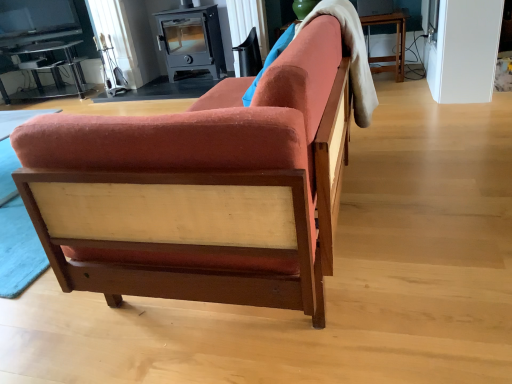
This screenshot has height=384, width=512. I want to click on clear glass table at upper left, so click(50, 72).

Is metallic wood-burning stove at upper center at the back of matte black swivel chair at upper center?

No, matte black swivel chair at upper center is not facing the opposite direction of metallic wood-burning stove at upper center.

Based on their sizes in the image, would you say matte black swivel chair at upper center is bigger or smaller than metallic wood-burning stove at upper center?

Considering their sizes, matte black swivel chair at upper center takes up less space than metallic wood-burning stove at upper center.

Considering the positions of objects matte black swivel chair at upper center and metallic wood-burning stove at upper center in the image provided, who is more to the right, matte black swivel chair at upper center or metallic wood-burning stove at upper center?

Positioned to the right is matte black swivel chair at upper center.

Considering the relative positions of matte black swivel chair at upper center and metallic wood-burning stove at upper center in the image provided, is matte black swivel chair at upper center in front of metallic wood-burning stove at upper center?

Yes, it is in front of metallic wood-burning stove at upper center.

Considering the relative positions of clear glass table at upper left and velvet orange couch at center in the image provided, is clear glass table at upper left to the left of velvet orange couch at center from the viewer's perspective?

Indeed, clear glass table at upper left is positioned on the left side of velvet orange couch at center.

Looking at this image, which of these two, clear glass table at upper left or velvet orange couch at center, is bigger?

velvet orange couch at center is bigger.

Looking at this image, from a real-world perspective, which object stands above the other?

In real-world perspective, velvet orange couch at center is above.

Consider the image. Between clear glass table at upper left and velvet orange couch at center, which one is positioned in front?

Positioned in front is velvet orange couch at center.

Does velvet orange couch at center have a greater width compared to metallic wood-burning stove at upper center?

Indeed, velvet orange couch at center has a greater width compared to metallic wood-burning stove at upper center.

From a real-world perspective, who is located higher, velvet orange couch at center or metallic wood-burning stove at upper center?

metallic wood-burning stove at upper center, from a real-world perspective.

Is velvet orange couch at center next to metallic wood-burning stove at upper center and touching it?

velvet orange couch at center and metallic wood-burning stove at upper center are not in contact.

Is velvet orange couch at center positioned in front of metallic wood-burning stove at upper center?

Yes, it is in front of metallic wood-burning stove at upper center.

Does velvet orange couch at center have a lesser height compared to matte black swivel chair at upper center?

In fact, velvet orange couch at center may be taller than matte black swivel chair at upper center.

Would you say velvet orange couch at center is a long distance from matte black swivel chair at upper center?

Yes, velvet orange couch at center and matte black swivel chair at upper center are quite far apart.

From the image's perspective, is velvet orange couch at center located above or below matte black swivel chair at upper center?

velvet orange couch at center is situated lower than matte black swivel chair at upper center in the image.

Is velvet orange couch at center behind matte black swivel chair at upper center?

No.

Is point (322, 296) more distant than point (73, 88)?

No, (322, 296) is closer to viewer.

Measure the distance from velvet orange couch at center to clear glass table at upper left.

A distance of 3.67 meters exists between velvet orange couch at center and clear glass table at upper left.

Do you think velvet orange couch at center is within clear glass table at upper left, or outside of it?

velvet orange couch at center is not inside clear glass table at upper left, it's outside.

Consider the image. In terms of height, does velvet orange couch at center look taller or shorter compared to clear glass table at upper left?

In the image, velvet orange couch at center appears to be taller than clear glass table at upper left.

Is metallic wood-burning stove at upper center beside matte black swivel chair at upper center?

No, metallic wood-burning stove at upper center is not with matte black swivel chair at upper center.

Considering the positions of objects metallic wood-burning stove at upper center and matte black swivel chair at upper center in the image provided, who is more to the right, metallic wood-burning stove at upper center or matte black swivel chair at upper center?

From the viewer's perspective, matte black swivel chair at upper center appears more on the right side.

Which object is closer to the camera taking this photo, metallic wood-burning stove at upper center or matte black swivel chair at upper center?

matte black swivel chair at upper center is more forward.

Who is taller, matte black swivel chair at upper center or velvet orange couch at center?

velvet orange couch at center is taller.

In order to click on swivel chair on the left of velvet orange couch at center in this screenshot , I will do `click(249, 55)`.

Is matte black swivel chair at upper center not close to velvet orange couch at center?

That's right, there is a large distance between matte black swivel chair at upper center and velvet orange couch at center.

Is velvet orange couch at center at the back of matte black swivel chair at upper center?

matte black swivel chair at upper center is not turned away from velvet orange couch at center.

Locate an element on the screen. The width and height of the screenshot is (512, 384). swivel chair below the metallic wood-burning stove at upper center (from the image's perspective) is located at coordinates (249, 55).

What are the coordinates of `studio couch in front of the clear glass table at upper left` in the screenshot? It's located at (198, 191).

Based on their spatial positions, is velvet orange couch at center or metallic wood-burning stove at upper center closer to clear glass table at upper left?

metallic wood-burning stove at upper center is positioned closer to the anchor clear glass table at upper left.

Which object lies nearer to the anchor point metallic wood-burning stove at upper center, clear glass table at upper left or matte black swivel chair at upper center?

matte black swivel chair at upper center is closer to metallic wood-burning stove at upper center.

Estimate the real-world distances between objects in this image. Which object is further from velvet orange couch at center, matte black swivel chair at upper center or metallic wood-burning stove at upper center?

The object further to velvet orange couch at center is metallic wood-burning stove at upper center.

Estimate the real-world distances between objects in this image. Which object is closer to matte black swivel chair at upper center, clear glass table at upper left or velvet orange couch at center?

Based on the image, clear glass table at upper left appears to be nearer to matte black swivel chair at upper center.

Looking at the image, which one is located further to velvet orange couch at center, metallic wood-burning stove at upper center or clear glass table at upper left?

clear glass table at upper left lies further to velvet orange couch at center than the other object.

Looking at this image, looking at the image, which one is located further to clear glass table at upper left, matte black swivel chair at upper center or velvet orange couch at center?

Based on the image, velvet orange couch at center appears to be further to clear glass table at upper left.

When comparing their distances from metallic wood-burning stove at upper center, does matte black swivel chair at upper center or velvet orange couch at center seem further?

velvet orange couch at center lies further to metallic wood-burning stove at upper center than the other object.

Looking at the image, which one is located further to metallic wood-burning stove at upper center, velvet orange couch at center or matte black swivel chair at upper center?

velvet orange couch at center is further to metallic wood-burning stove at upper center.

You are a GUI agent. You are given a task and a screenshot of the screen. Output one action in this format:
    pyautogui.click(x=<x>, y=<y>)
    Task: Click on the appliance between velvet orange couch at center and clear glass table at upper left from front to back
    
    Given the screenshot: What is the action you would take?
    pyautogui.click(x=191, y=39)

At what (x,y) coordinates should I click in order to perform the action: click on swivel chair between velvet orange couch at center and clear glass table at upper left in the front-back direction. Please return your answer as a coordinate pair (x, y). The image size is (512, 384). Looking at the image, I should click on (249, 55).

The width and height of the screenshot is (512, 384). I want to click on swivel chair located between velvet orange couch at center and metallic wood-burning stove at upper center in the depth direction, so click(x=249, y=55).

Where is `appliance situated between clear glass table at upper left and matte black swivel chair at upper center from left to right`? appliance situated between clear glass table at upper left and matte black swivel chair at upper center from left to right is located at coordinates coord(191,39).